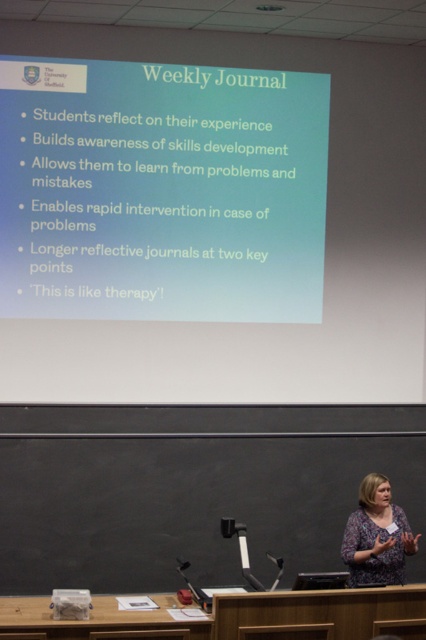
Question: Can you confirm if white matte projector screen at upper center is smaller than floral-patterned blouse at lower right?

Choices:
 (A) no
 (B) yes

Answer: (A)

Question: Which point is closer to the camera?

Choices:
 (A) floral-patterned blouse at lower right
 (B) white matte projector screen at upper center

Answer: (A)

Question: Can you confirm if white matte projector screen at upper center is smaller than floral-patterned blouse at lower right?

Choices:
 (A) no
 (B) yes

Answer: (A)

Question: Is white matte projector screen at upper center below floral-patterned blouse at lower right?

Choices:
 (A) yes
 (B) no

Answer: (B)

Question: Which point is closer to the camera taking this photo?

Choices:
 (A) (46, 112)
 (B) (360, 531)

Answer: (B)